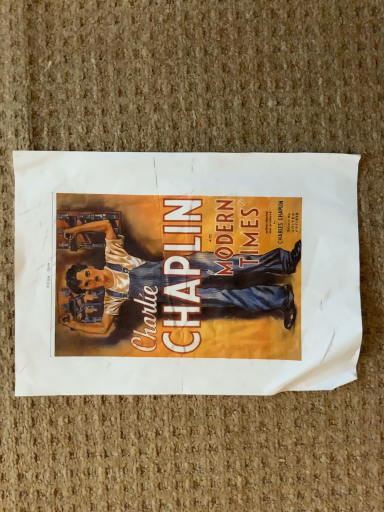
Describe the element at coordinates (185, 273) in the screenshot. I see `matte paper poster at center` at that location.

Where is `matte paper poster at center`? matte paper poster at center is located at coordinates (185, 273).

The height and width of the screenshot is (512, 384). I want to click on matte paper poster at center, so click(185, 273).